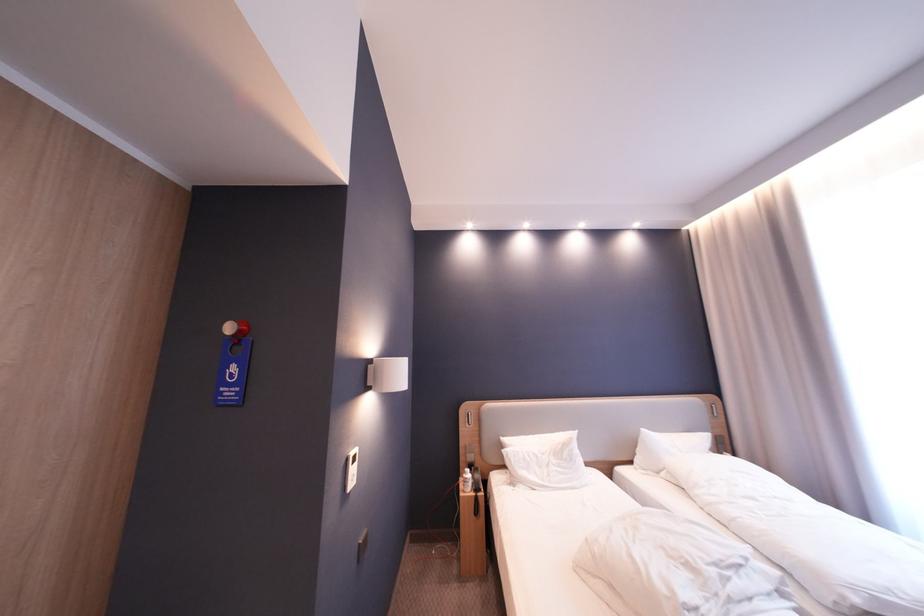
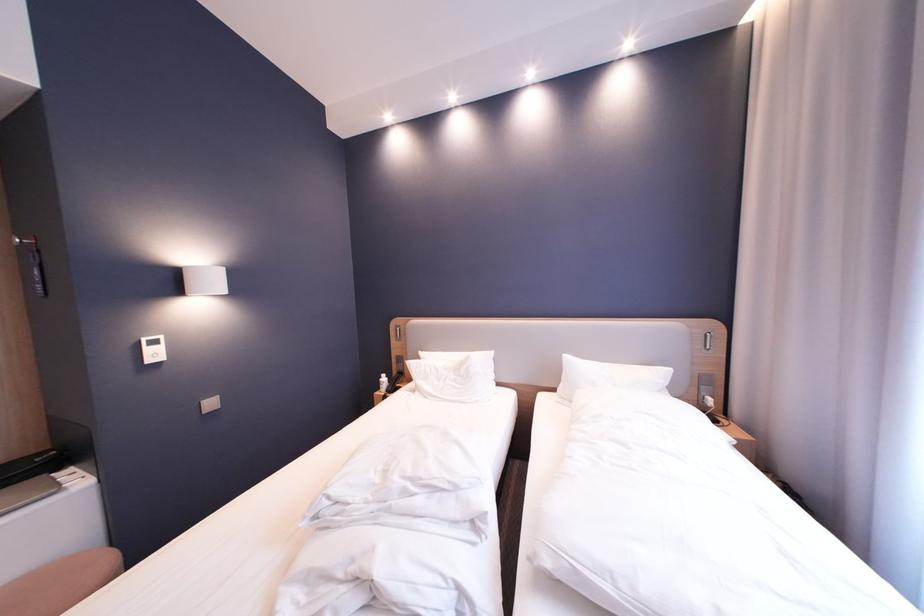
Locate, in the second image, the point that corresponds to [552,469] in the first image.

(450, 382)